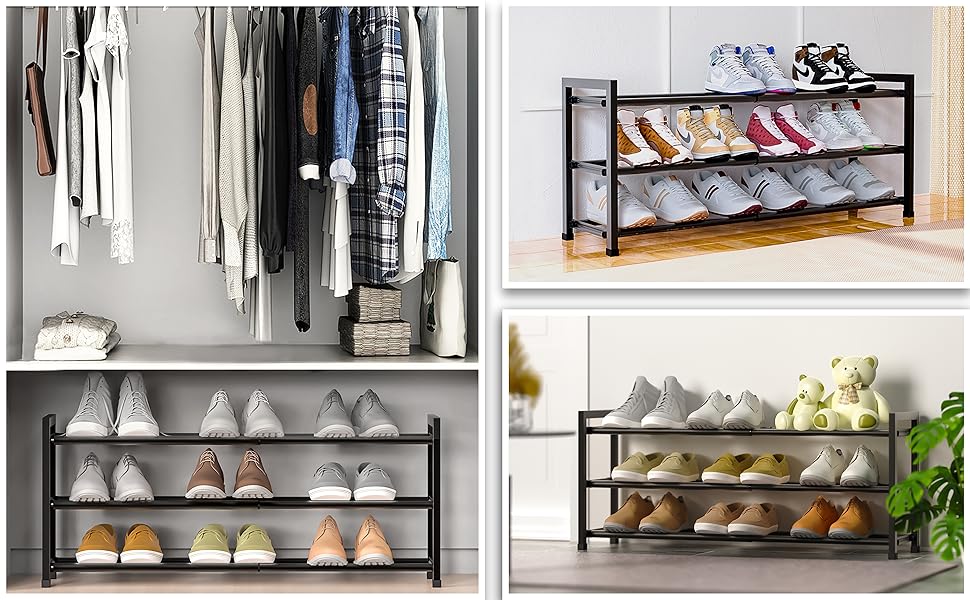
I want to click on shelves for the shoes, so click(595, 102), click(593, 172), click(600, 231), click(587, 423), click(586, 484), click(587, 528), click(428, 438), click(415, 496), click(416, 567).